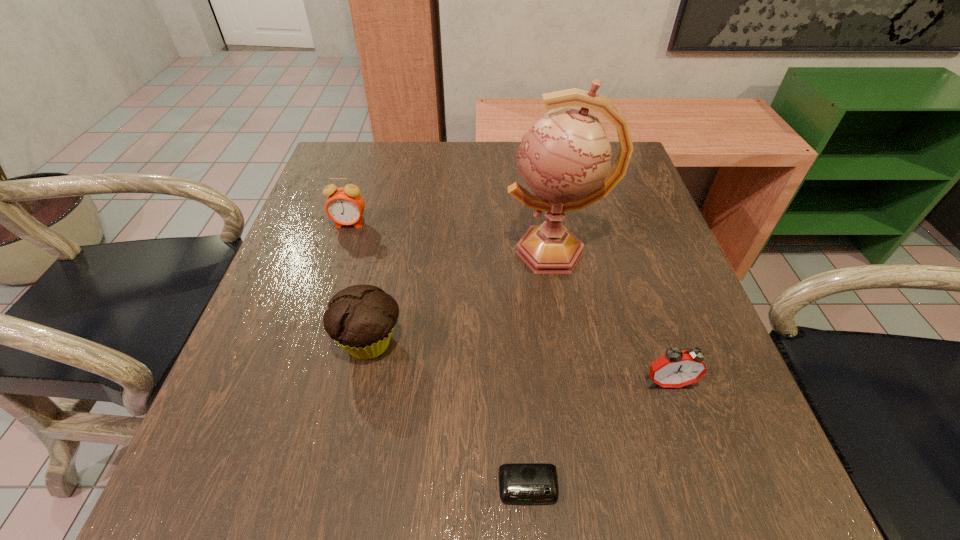
Find the location of a particular element. Image resolution: width=960 pixels, height=540 pixels. free space that satisfies the following two spatial constraints: 1. on the front-facing side of the tallest object; 2. on the display of the second alarm clock from right to left is located at coordinates (595, 487).

At what (x,y) coordinates should I click in order to perform the action: click on vacant area that satisfies the following two spatial constraints: 1. on the front-facing side of the tallest object; 2. on the front side of the muffin. Please return your answer as a coordinate pair (x, y). Image resolution: width=960 pixels, height=540 pixels. Looking at the image, I should click on (570, 343).